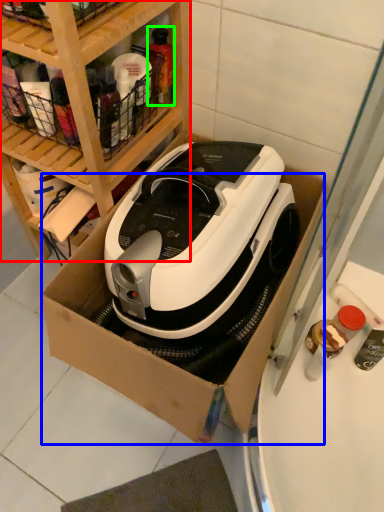
Question: Which object is positioned farthest from shelf (highlighted by a red box)? Select from cardboard box (highlighted by a blue box) and bottle (highlighted by a green box).

Choices:
 (A) cardboard box
 (B) bottle

Answer: (A)